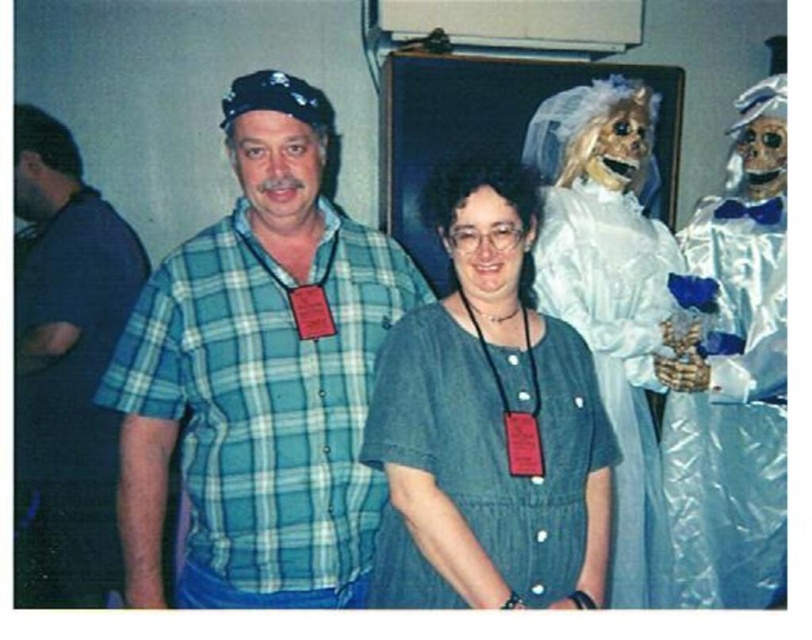
Question: Which object is the closest to the green plaid shirt at center?

Choices:
 (A) white satin dress at right
 (B) denim shirt at center
 (C) shiny silver suit at right

Answer: (B)

Question: Does denim shirt at center appear on the right side of shiny silver suit at right?

Choices:
 (A) yes
 (B) no

Answer: (B)

Question: Estimate the real-world distances between objects in this image. Which object is closer to the denim shirt at center?

Choices:
 (A) green plaid shirt at center
 (B) dark blue kilt at left
 (C) white satin dress at right
 (D) shiny silver suit at right

Answer: (A)

Question: Which point is closer to the camera?

Choices:
 (A) (571, 531)
 (B) (726, 243)
 (C) (63, 147)

Answer: (A)

Question: Can you confirm if green plaid shirt at center is smaller than denim shirt at center?

Choices:
 (A) no
 (B) yes

Answer: (B)

Question: Can you confirm if denim shirt at center is positioned to the left of white satin dress at right?

Choices:
 (A) yes
 (B) no

Answer: (A)